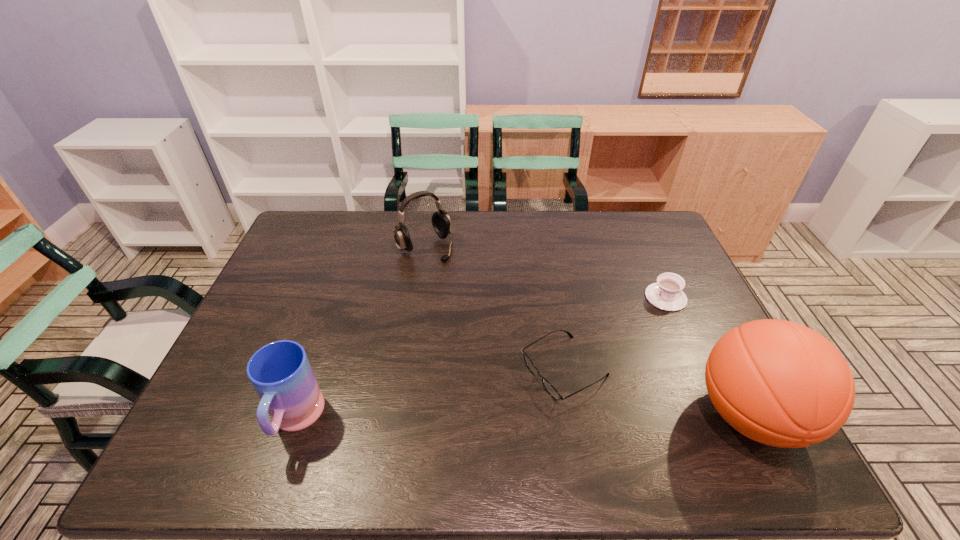
This screenshot has height=540, width=960. In order to click on free spot on the desktop that is between the leftmost object and the basketball and is positioned on the front-facing side of the spectacles in this screenshot , I will do `click(475, 418)`.

At what (x,y) coordinates should I click in order to perform the action: click on vacant space on the desktop that is between the mug and the tallest object and is positioned on the handle side of the teacup. Please return your answer as a coordinate pair (x, y). The image size is (960, 540). Looking at the image, I should click on (524, 417).

The image size is (960, 540). Identify the location of vacant space on the desktop that is between the mug and the tallest object and is positioned with the microphone on the side of the farthest object. (575, 417).